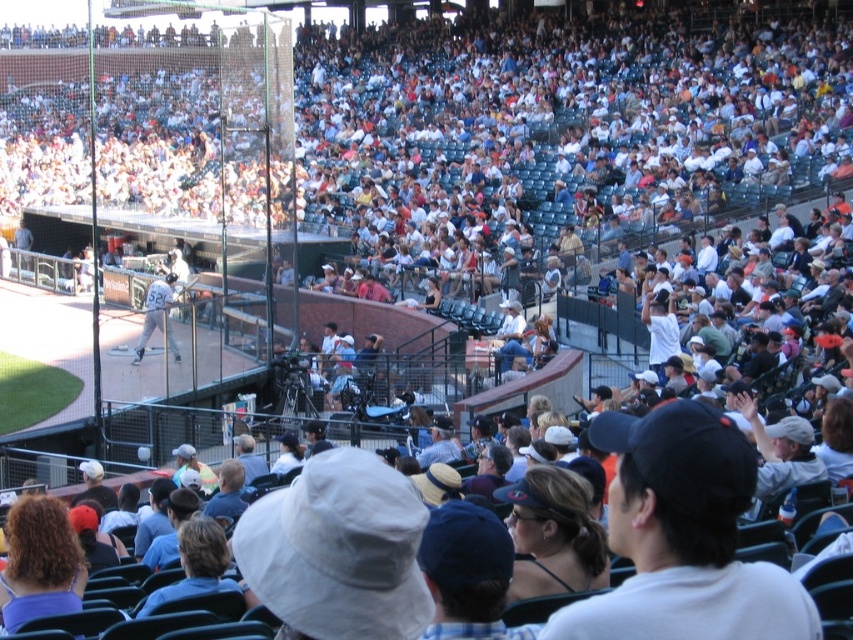
Can you confirm if light brown hair at lower center is thinner than matte gray uniform at center?

Indeed, light brown hair at lower center has a lesser width compared to matte gray uniform at center.

Does light brown hair at lower center have a greater width compared to matte gray uniform at center?

No, light brown hair at lower center is not wider than matte gray uniform at center.

Does point (172, 593) come in front of point (172, 348)?

Yes, point (172, 593) is closer to viewer.

Locate an element on the screen. The width and height of the screenshot is (853, 640). light brown hair at lower center is located at coordinates (196, 564).